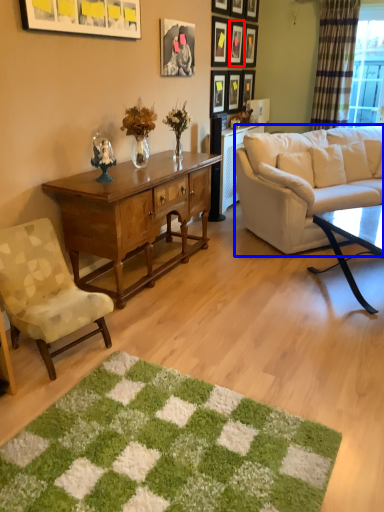
Question: Which of the following is the closest to the observer, picture frame (highlighted by a red box) or studio couch (highlighted by a blue box)?

Choices:
 (A) picture frame
 (B) studio couch

Answer: (B)